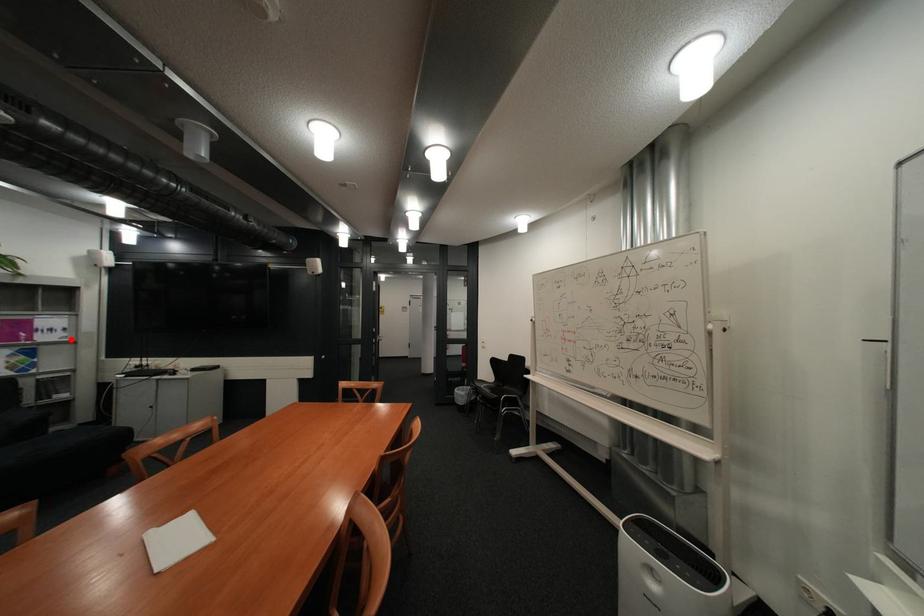
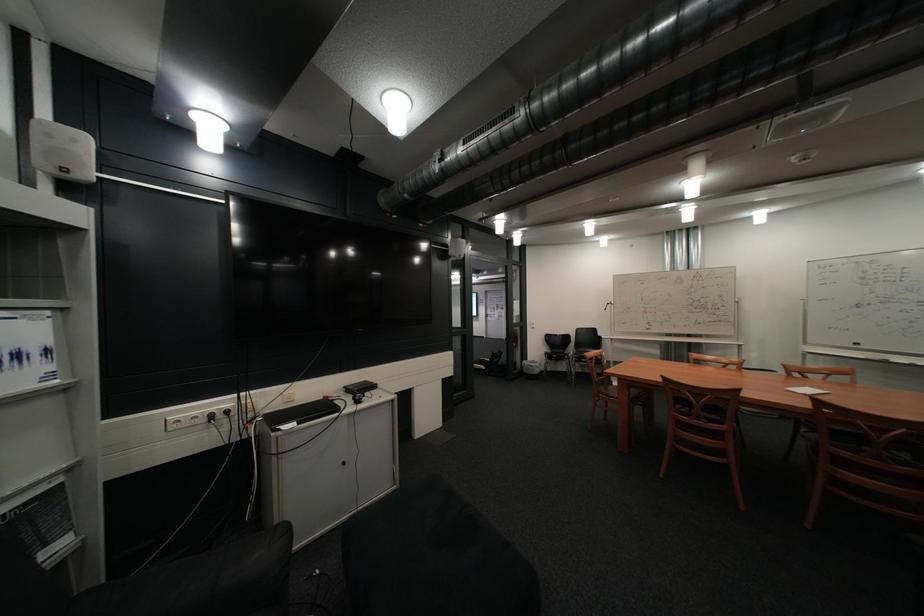
Find the pixel in the second image that matches the highlighted location in the first image.

(46, 386)